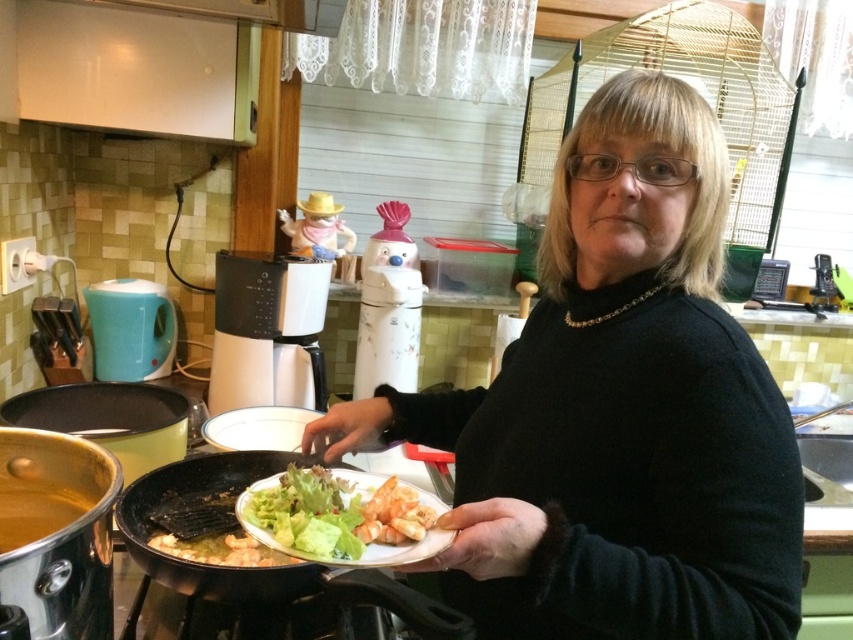
Question: Is the position of fresh green salad at center more distant than that of black non-stick frying pan at lower center?

Choices:
 (A) yes
 (B) no

Answer: (B)

Question: Does black matte sweater at center appear over black non-stick frying pan at lower center?

Choices:
 (A) yes
 (B) no

Answer: (A)

Question: Which point is farther from the camera taking this photo?

Choices:
 (A) (334, 467)
 (B) (724, 522)
 (C) (370, 552)

Answer: (A)

Question: Which point is farther to the camera?

Choices:
 (A) (167, 483)
 (B) (403, 529)
 (C) (595, 385)

Answer: (A)

Question: Is fresh green salad at center below black non-stick frying pan at lower center?

Choices:
 (A) yes
 (B) no

Answer: (B)

Question: Among these points, which one is farthest from the camera?

Choices:
 (A) (575, 584)
 (B) (405, 499)
 (C) (183, 499)

Answer: (C)